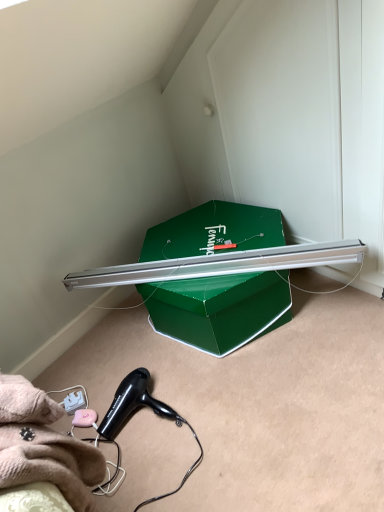
Question: Can you confirm if green cardboard box at center is thinner than black plastic hair dryer at lower left?

Choices:
 (A) yes
 (B) no

Answer: (B)

Question: Does green cardboard box at center appear on the left side of black plastic hair dryer at lower left?

Choices:
 (A) yes
 (B) no

Answer: (B)

Question: Is green cardboard box at center at the right side of black plastic hair dryer at lower left?

Choices:
 (A) yes
 (B) no

Answer: (A)

Question: Is the depth of green cardboard box at center less than that of black plastic hair dryer at lower left?

Choices:
 (A) no
 (B) yes

Answer: (A)

Question: Is green cardboard box at center not within black plastic hair dryer at lower left?

Choices:
 (A) no
 (B) yes

Answer: (B)

Question: From the image's perspective, is green cardboard box at center on black plastic hair dryer at lower left?

Choices:
 (A) yes
 (B) no

Answer: (A)

Question: Does black plastic hair dryer at lower left have a larger size compared to green cardboard box at center?

Choices:
 (A) yes
 (B) no

Answer: (B)

Question: Is the depth of black plastic hair dryer at lower left less than that of green cardboard box at center?

Choices:
 (A) yes
 (B) no

Answer: (A)

Question: Considering the relative sizes of black plastic hair dryer at lower left and green cardboard box at center in the image provided, is black plastic hair dryer at lower left taller than green cardboard box at center?

Choices:
 (A) no
 (B) yes

Answer: (A)

Question: Can you confirm if black plastic hair dryer at lower left is shorter than green cardboard box at center?

Choices:
 (A) no
 (B) yes

Answer: (B)

Question: From the image's perspective, does black plastic hair dryer at lower left appear higher than green cardboard box at center?

Choices:
 (A) no
 (B) yes

Answer: (A)

Question: Is black plastic hair dryer at lower left surrounding green cardboard box at center?

Choices:
 (A) no
 (B) yes

Answer: (A)

Question: In terms of width, does black plastic hair dryer at lower left look wider or thinner when compared to green cardboard box at center?

Choices:
 (A) thin
 (B) wide

Answer: (A)